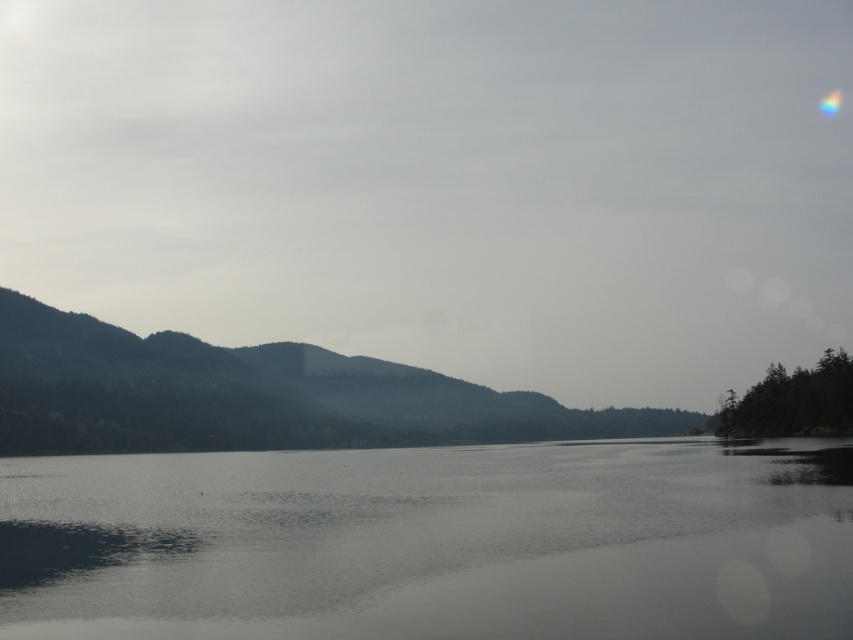
Question: Which point appears farthest from the camera in this image?

Choices:
 (A) (386, 368)
 (B) (343, 609)

Answer: (A)

Question: Which object is closer to the camera taking this photo?

Choices:
 (A) transparent water at center
 (B) green matte forest at left

Answer: (A)

Question: Is transparent water at center smaller than green matte forest at left?

Choices:
 (A) yes
 (B) no

Answer: (A)

Question: Does transparent water at center have a smaller size compared to green matte forest at left?

Choices:
 (A) no
 (B) yes

Answer: (B)

Question: Is transparent water at center above green matte forest at left?

Choices:
 (A) no
 (B) yes

Answer: (B)

Question: Which point is closer to the camera?

Choices:
 (A) (10, 300)
 (B) (334, 460)

Answer: (B)